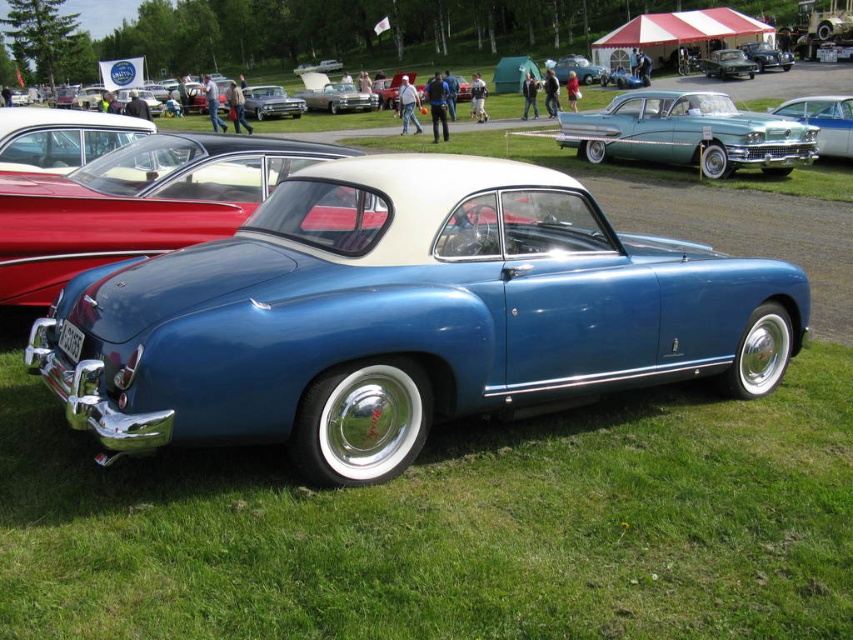
Question: From the image, what is the correct spatial relationship of teal glossy sedan at upper right in relation to shiny black car at center?

Choices:
 (A) below
 (B) above

Answer: (A)

Question: Which of the following is the closest to the observer?

Choices:
 (A) teal glossy sedan at upper right
 (B) blue metallic car at center

Answer: (B)

Question: Which object is positioned closest to the blue metallic car at center?

Choices:
 (A) shiny black car at center
 (B) shiny silver car at center
 (C) metallic blue car at center
 (D) shiny black sedan at center

Answer: (B)

Question: Is shiny silver car at center positioned at the back of shiny black sedan at center?

Choices:
 (A) no
 (B) yes

Answer: (A)

Question: Which of the following is the closest to the observer?

Choices:
 (A) shiny silver car at center
 (B) shiny chrome car at center

Answer: (A)

Question: Does shiny silver car at center have a smaller size compared to metallic blue car at center?

Choices:
 (A) yes
 (B) no

Answer: (B)